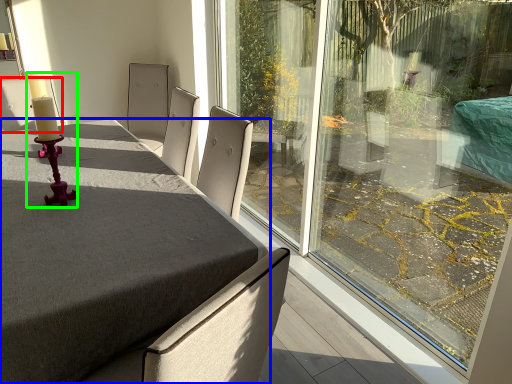
Question: Estimate the real-world distances between objects in this image. Which object is closer to chair (highlighted by a red box), table (highlighted by a blue box) or candle holder (highlighted by a green box)?

Choices:
 (A) table
 (B) candle holder

Answer: (B)